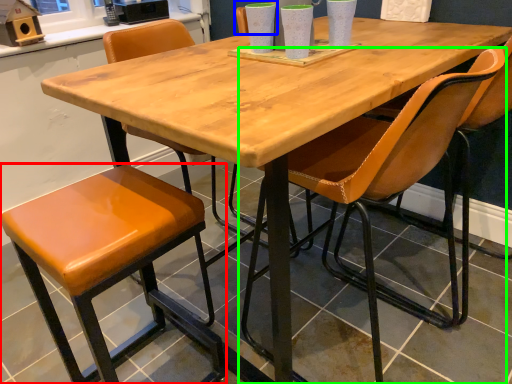
Question: Which is nearer to the stool (highlighted by a red box)? chair (highlighted by a blue box) or chair (highlighted by a green box).

Choices:
 (A) chair
 (B) chair

Answer: (B)